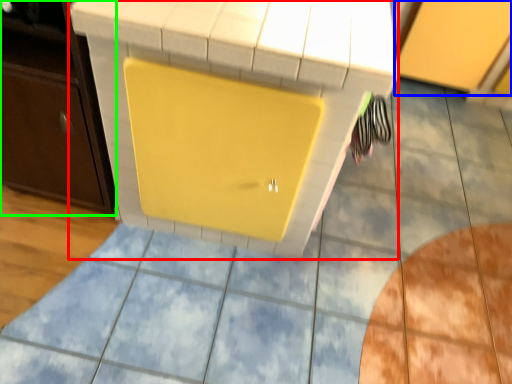
Question: Which object is the closest to the vanity (highlighted by a red box)? Choose among these: cabinetry (highlighted by a blue box) or cabinetry (highlighted by a green box).

Choices:
 (A) cabinetry
 (B) cabinetry

Answer: (B)